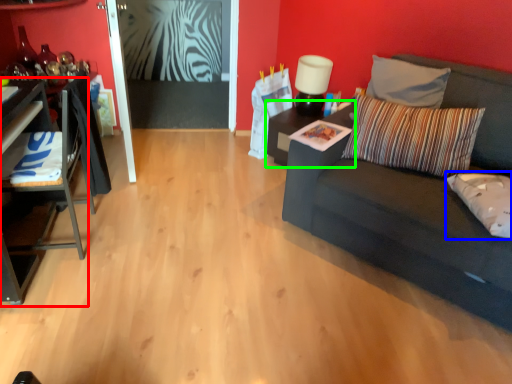
Question: Estimate the real-world distances between objects in this image. Which object is closer to table (highlighted by a red box), pillow (highlighted by a blue box) or table (highlighted by a green box)?

Choices:
 (A) pillow
 (B) table

Answer: (B)